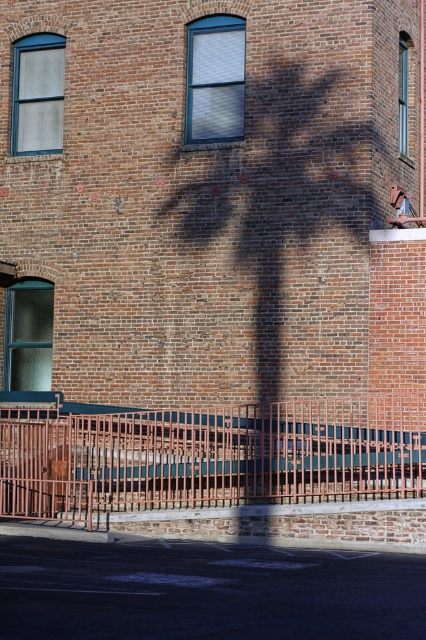
Question: Is brown textured tree at center further to camera compared to rusty metal fence at lower center?

Choices:
 (A) no
 (B) yes

Answer: (B)

Question: Is brown textured tree at center positioned before rusty metal fence at lower center?

Choices:
 (A) yes
 (B) no

Answer: (B)

Question: Which point is closer to the camera taking this photo?

Choices:
 (A) (359, 472)
 (B) (239, 168)

Answer: (A)

Question: Which point is farther from the camera taking this photo?

Choices:
 (A) (261, 259)
 (B) (221, 460)

Answer: (A)

Question: Does brown textured tree at center appear over rusty metal fence at lower center?

Choices:
 (A) no
 (B) yes

Answer: (B)